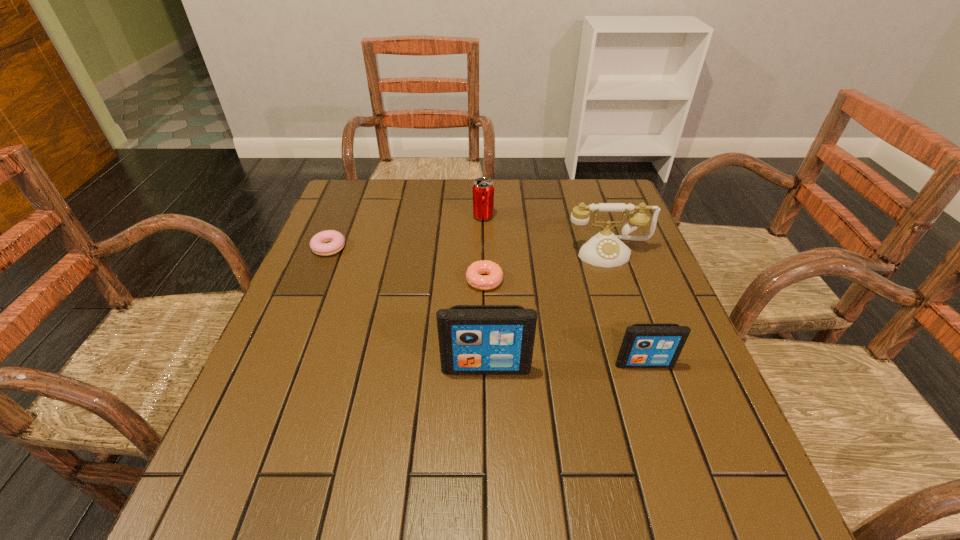
Identify the location of vacant space at the left edge. The height and width of the screenshot is (540, 960). (292, 315).

At what (x,y) coordinates should I click in order to perform the action: click on free space at the right edge of the desktop. Please return your answer as a coordinate pair (x, y). Image resolution: width=960 pixels, height=540 pixels. Looking at the image, I should click on (666, 319).

The image size is (960, 540). In the image, there is a desktop. What are the coordinates of `vacant space at the far left corner` in the screenshot? It's located at (374, 205).

The height and width of the screenshot is (540, 960). Find the location of `free space at the far right corner of the desktop`. free space at the far right corner of the desktop is located at coordinates (599, 183).

Find the location of a particular element. The width and height of the screenshot is (960, 540). free space that is in between the right doughnut and the right iPod is located at coordinates (564, 322).

Locate an element on the screen. The width and height of the screenshot is (960, 540). unoccupied area between the shorter iPod and the left iPod is located at coordinates (565, 366).

Where is `free point between the shorter iPod and the telephone`? free point between the shorter iPod and the telephone is located at coordinates (626, 308).

The width and height of the screenshot is (960, 540). What are the coordinates of `free space between the left doughnut and the farthest object` in the screenshot? It's located at (406, 232).

Locate an element on the screen. The width and height of the screenshot is (960, 540). free space that is in between the telephone and the left iPod is located at coordinates (547, 310).

The width and height of the screenshot is (960, 540). I want to click on unoccupied area between the left iPod and the soda can, so click(485, 292).